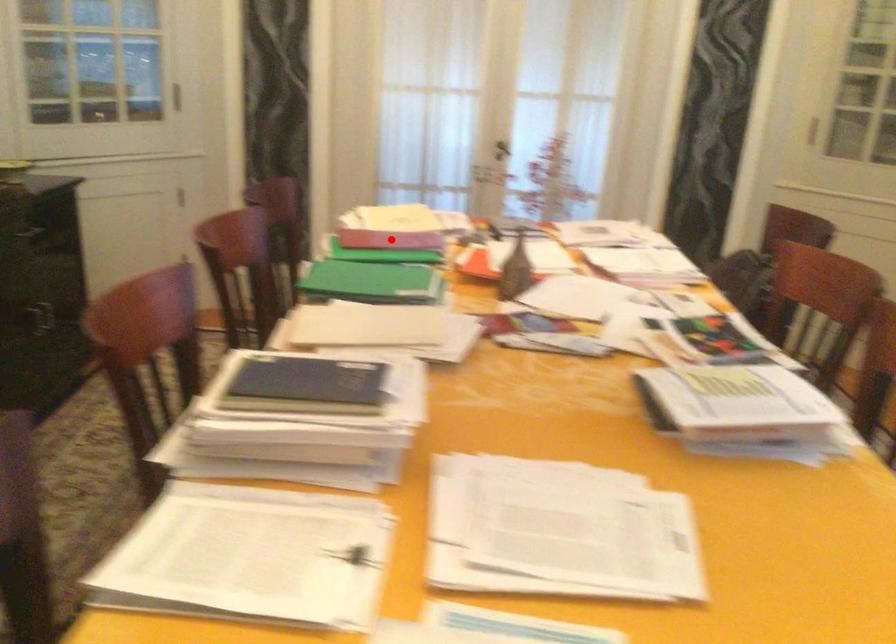
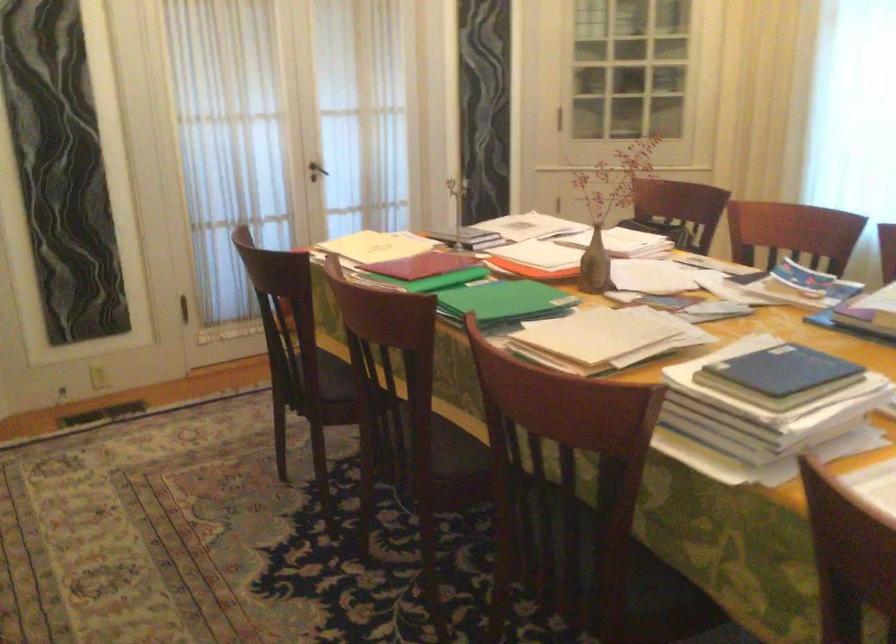
Locate, in the second image, the point that corresponds to the highlighted location in the first image.

(423, 265)